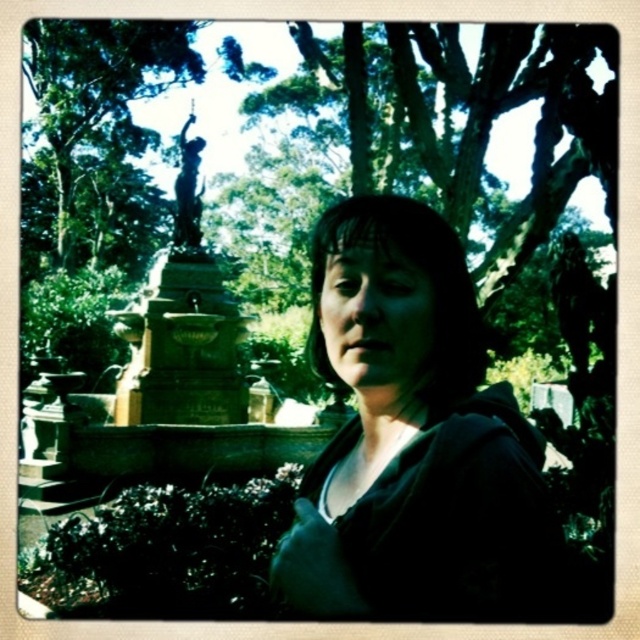
You are standing in the park and see the person in the image. There is a green leafy tree at upper left marked by point (97, 138). If you want to take a photo of the person without the tree in the background, where should you position yourself relative to the person?

To avoid the green leafy tree at upper left marked by point (97, 138), you should position yourself to the right side of the person so that the tree is out of the frame.

You are a drone operator trying to capture a photo of the person in the park. You have two points marked on your screen for camera positioning. The first point is at coordinates point (x=122, y=74) and the second is at point (x=182, y=129). Which point should you choose to ensure the camera is positioned behind the person for an over the shoulder shot?

Point (x=122, y=74) is behind point (x=182, y=129), so you should choose point (x=122, y=74) to position the camera behind the person for an over the shoulder shot.

You are standing in a park and see a person at point (406,422). You want to throw a ball to them. If the maximum distance you can throw is 20 meters, will you be able to reach them?

The distance between you and the person at point (406,422) is 18.93 meters, which is within your throwing range of 20 meters. Yes, you can reach them.